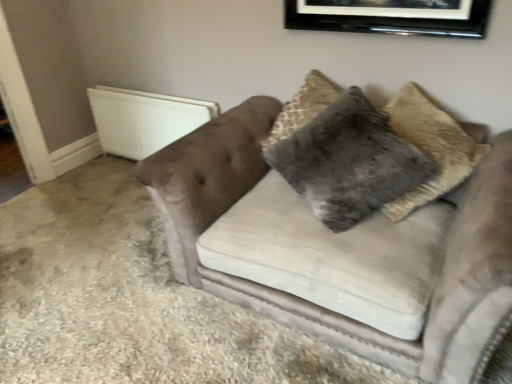
From a real-world perspective, locate several points within the vacant area on top of black glossy picture frame at upper center. Your answer should be formatted as a list of tuples, i.e. [(x1, y1)], where each tuple contains the x and y coordinates of a point satisfying the conditions above.

[(0.713, -0.001)]